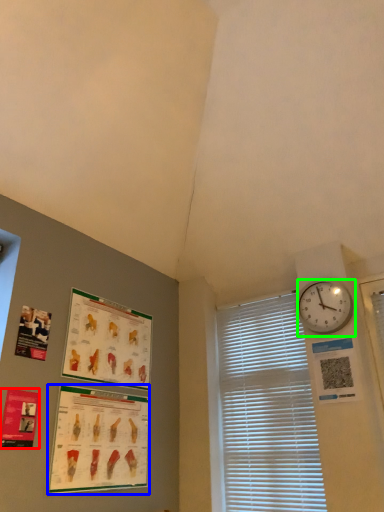
Question: Which object is positioned farthest from poster page (highlighted by a red box)? Select from poster page (highlighted by a blue box) and wall clock (highlighted by a green box).

Choices:
 (A) poster page
 (B) wall clock

Answer: (B)